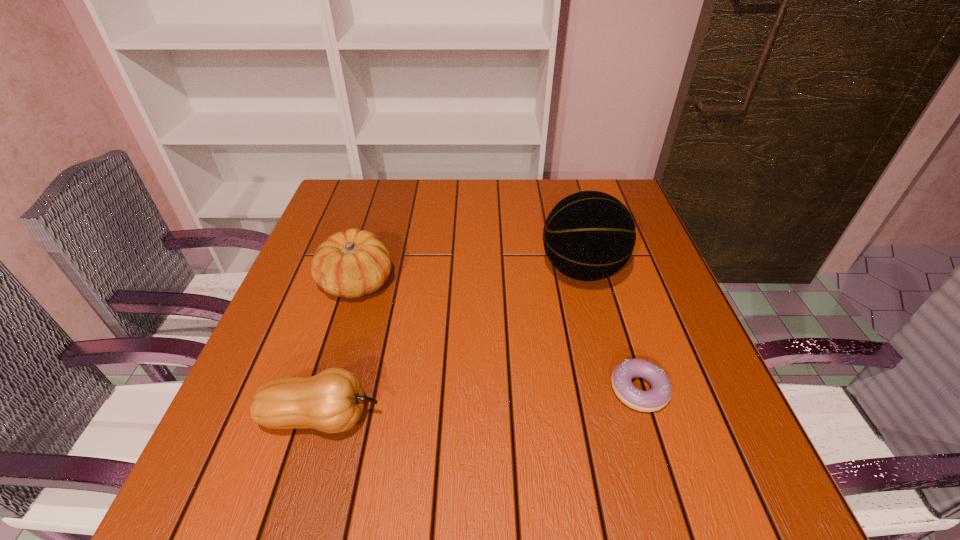
The height and width of the screenshot is (540, 960). In order to click on basketball in this screenshot , I will do `click(589, 235)`.

Where is `the farther gourd`? The image size is (960, 540). the farther gourd is located at coordinates (350, 264).

Find the location of a particular element. The height and width of the screenshot is (540, 960). the nearer gourd is located at coordinates (332, 401).

At what (x,y) coordinates should I click in order to perform the action: click on doughnut. Please return your answer as a coordinate pair (x, y). The width and height of the screenshot is (960, 540). Looking at the image, I should click on (656, 398).

This screenshot has height=540, width=960. I want to click on free location located on the left of the tallest object, so click(x=397, y=270).

This screenshot has height=540, width=960. Find the location of `free region located on the back of the farther gourd`. free region located on the back of the farther gourd is located at coordinates (387, 183).

The height and width of the screenshot is (540, 960). In order to click on vacant space located on the stem side of the nearer gourd in this screenshot , I will do (x=427, y=417).

Image resolution: width=960 pixels, height=540 pixels. Identify the location of vacant space located 0.150m on the front of the shortest object. (675, 506).

The height and width of the screenshot is (540, 960). Find the location of `basketball at the right edge`. basketball at the right edge is located at coordinates (589, 235).

This screenshot has width=960, height=540. What are the coordinates of `doughnut that is positioned at the right edge` in the screenshot? It's located at (656, 398).